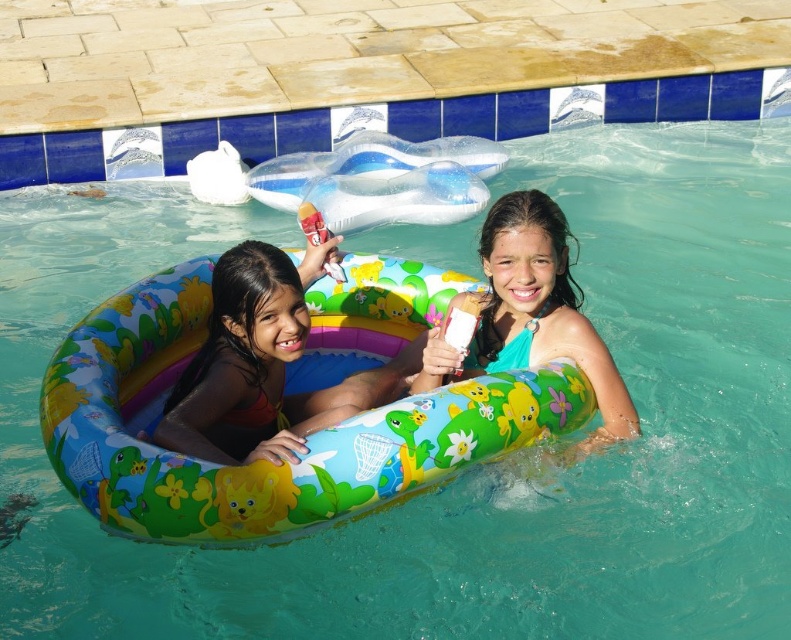
Question: Considering the relative positions of multicolored inflatable ring at center and multicolored rubber ring at center in the image provided, where is multicolored inflatable ring at center located with respect to multicolored rubber ring at center?

Choices:
 (A) above
 (B) below

Answer: (B)

Question: Is multicolored inflatable ring at center closer to the viewer compared to multicolored rubber ring at center?

Choices:
 (A) no
 (B) yes

Answer: (A)

Question: Among these points, which one is nearest to the camera?

Choices:
 (A) (279, 285)
 (B) (532, 228)

Answer: (A)

Question: Can you confirm if multicolored inflatable ring at center is thinner than multicolored rubber ring at center?

Choices:
 (A) no
 (B) yes

Answer: (A)

Question: Which object is farther from the camera taking this photo?

Choices:
 (A) multicolored inflatable ring at center
 (B) multicolored rubber ring at center

Answer: (A)